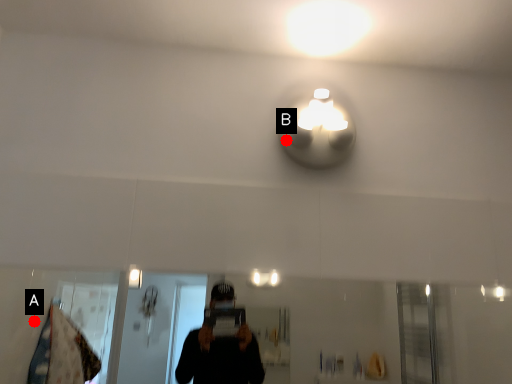
Question: Two points are circled on the image, labeled by A and B beside each circle. Which point appears closest to the camera in this image?

Choices:
 (A) A is closer
 (B) B is closer

Answer: (B)